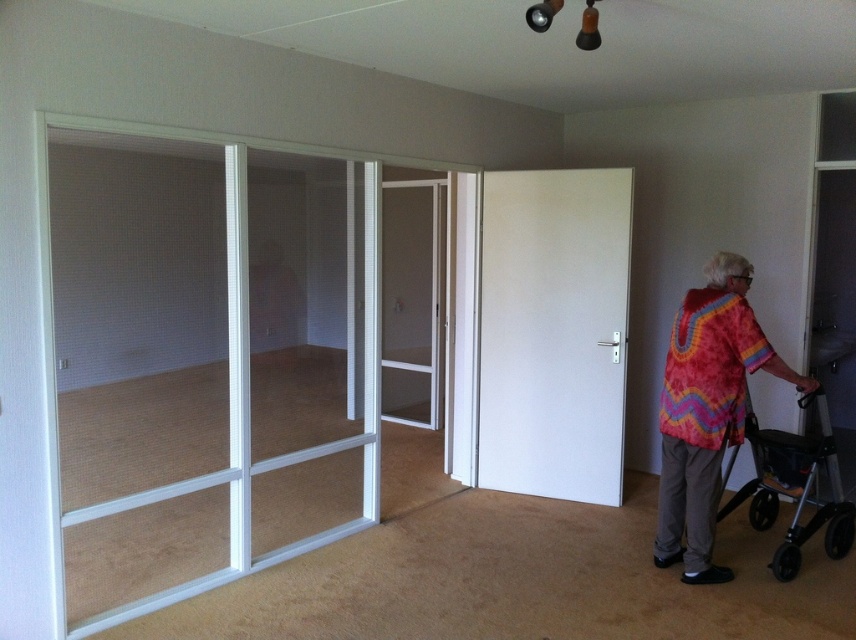
You are trying to determine which door is shorter between the white matte door at center and the clear glass screen door at center. Based on the scene, which one is shorter?

The white matte door at center is shorter than the clear glass screen door at center.

You are standing in the living room and want to exit through the clear glass door at left. However, you notice the white matte door at center might be closer to your current position. Which door is closer to you?

The clear glass door at left is positioned on the left side of white matte door at center, so the white matte door at center is closer to you.